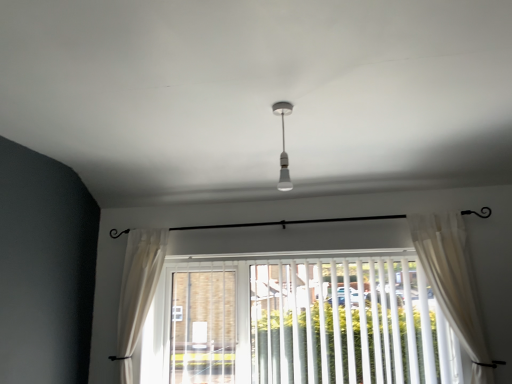
Question: Is white sheer curtain at lower center, the 2th curtain in the right-to-left sequence, positioned beyond the bounds of white plastic blinds at center?

Choices:
 (A) yes
 (B) no

Answer: (A)

Question: Is white sheer curtain at lower center, the 2th curtain in the right-to-left sequence, facing away from white plastic blinds at center?

Choices:
 (A) no
 (B) yes

Answer: (A)

Question: Can you confirm if white sheer curtain at lower center, arranged as the 2th curtain when viewed from the front, is thinner than white plastic blinds at center?

Choices:
 (A) yes
 (B) no

Answer: (B)

Question: Considering the relative sizes of white sheer curtain at lower center, the 2th curtain in the right-to-left sequence, and white plastic blinds at center in the image provided, is white sheer curtain at lower center, the 2th curtain in the right-to-left sequence, bigger than white plastic blinds at center?

Choices:
 (A) yes
 (B) no

Answer: (B)

Question: Is white sheer curtain at lower center, which ranks as the first curtain in back-to-front order, aimed at white plastic blinds at center?

Choices:
 (A) yes
 (B) no

Answer: (B)

Question: Is white sheer curtain at lower center, the 2th curtain in the right-to-left sequence, closer to the viewer compared to white plastic blinds at center?

Choices:
 (A) yes
 (B) no

Answer: (B)

Question: Is white sheer curtain at lower center, the first curtain when ordered from left to right, taller than white glossy bulb at center?

Choices:
 (A) no
 (B) yes

Answer: (B)

Question: From a real-world perspective, does white sheer curtain at lower center, the first curtain when ordered from left to right, sit lower than white glossy bulb at center?

Choices:
 (A) no
 (B) yes

Answer: (B)

Question: Considering the relative positions of white sheer curtain at lower center, the first curtain when ordered from left to right, and white glossy bulb at center in the image provided, is white sheer curtain at lower center, the first curtain when ordered from left to right, behind white glossy bulb at center?

Choices:
 (A) no
 (B) yes

Answer: (B)

Question: Would you say white sheer curtain at lower center, the first curtain when ordered from left to right, contains white glossy bulb at center?

Choices:
 (A) yes
 (B) no

Answer: (B)

Question: Is white sheer curtain at lower center, which ranks as the first curtain in back-to-front order, to the right of white glossy bulb at center from the viewer's perspective?

Choices:
 (A) no
 (B) yes

Answer: (A)

Question: Can you see white sheer curtain at lower center, the first curtain when ordered from left to right, touching white glossy bulb at center?

Choices:
 (A) yes
 (B) no

Answer: (B)

Question: Does white sheer curtain at right, which ranks as the second curtain in left-to-right order, come behind white glossy bulb at center?

Choices:
 (A) no
 (B) yes

Answer: (B)